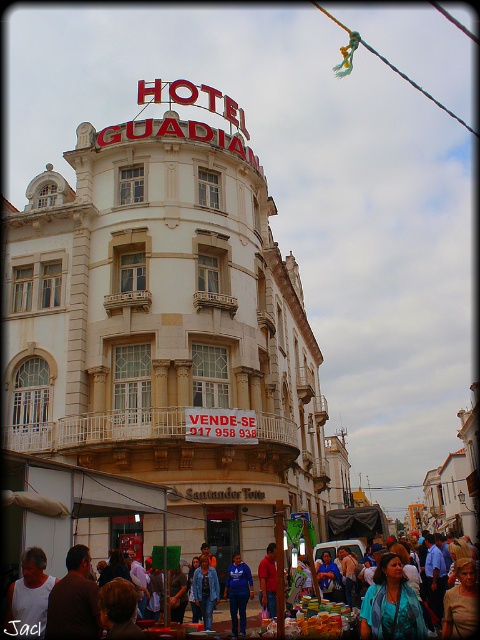
Is red plastic sign at center above blue fabric shirt at center?

Yes.

Which is more to the right, red plastic sign at center or blue fabric shirt at center?

From the viewer's perspective, blue fabric shirt at center appears more on the right side.

Image resolution: width=480 pixels, height=640 pixels. What do you see at coordinates (220, 426) in the screenshot?
I see `red plastic sign at center` at bounding box center [220, 426].

Where is `red plastic sign at center`? red plastic sign at center is located at coordinates (220, 426).

Does blue denim jacket at center appear on the left side of brown fabric shirt at lower left?

No, blue denim jacket at center is not to the left of brown fabric shirt at lower left.

From the picture: Who is positioned more to the left, blue denim jacket at center or brown fabric shirt at lower left?

brown fabric shirt at lower left

The image size is (480, 640). What do you see at coordinates (140, 634) in the screenshot? I see `blue denim jacket at center` at bounding box center [140, 634].

The image size is (480, 640). Find the location of `blue denim jacket at center`. blue denim jacket at center is located at coordinates (140, 634).

What do you see at coordinates (140, 634) in the screenshot? The height and width of the screenshot is (640, 480). I see `blue denim jacket at center` at bounding box center [140, 634].

Is point (447, 595) closer to viewer compared to point (201, 422)?

Yes, it is.

What do you see at coordinates (140, 634) in the screenshot?
I see `blue denim jacket at center` at bounding box center [140, 634].

Where is `blue denim jacket at center`? The height and width of the screenshot is (640, 480). blue denim jacket at center is located at coordinates (140, 634).